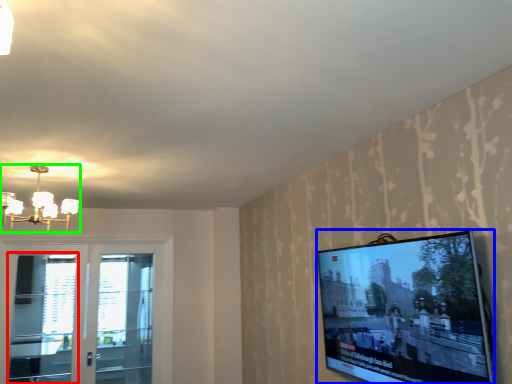
Question: Which is farther away from screen door (highlighted by a red box)? television (highlighted by a blue box) or light fixture (highlighted by a green box)?

Choices:
 (A) television
 (B) light fixture

Answer: (A)